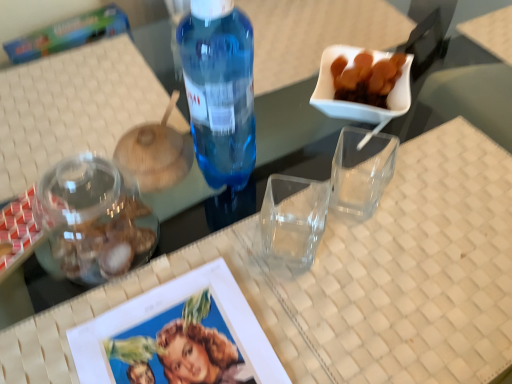
Question: From a real-world perspective, is translucent plastic bottle at center above or below clear glass jar at lower left?

Choices:
 (A) above
 (B) below

Answer: (A)

Question: Considering the positions of point (181, 59) and point (105, 198), is point (181, 59) closer or farther from the camera than point (105, 198)?

Choices:
 (A) farther
 (B) closer

Answer: (A)

Question: Is translucent plastic bottle at center bigger or smaller than clear glass jar at lower left?

Choices:
 (A) big
 (B) small

Answer: (A)

Question: In terms of height, does clear glass jar at lower left look taller or shorter compared to translucent plastic bottle at center?

Choices:
 (A) tall
 (B) short

Answer: (B)

Question: Is clear glass jar at lower left inside or outside of translucent plastic bottle at center?

Choices:
 (A) inside
 (B) outside

Answer: (B)

Question: Considering the relative positions of clear glass jar at lower left and translucent plastic bottle at center in the image provided, is clear glass jar at lower left to the left or to the right of translucent plastic bottle at center?

Choices:
 (A) left
 (B) right

Answer: (A)

Question: From the image's perspective, relative to translucent plastic bottle at center, is clear glass jar at lower left above or below?

Choices:
 (A) below
 (B) above

Answer: (A)